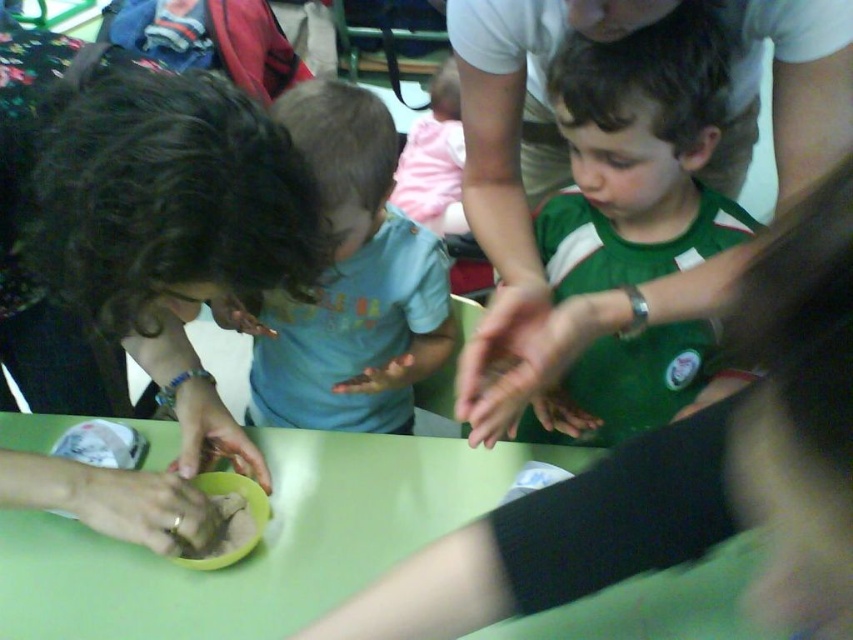
You are an observer watching the scene at the table. The smooth beige hand at lower left and the brown clay bowl at center are both on the table. Which object is bigger in size?

The smooth beige hand at lower left is larger in size compared to the brown clay bowl at center according to the description.

You are standing in front of the table and want to place a small object on the smooth beige hand at lower left. Where should you aim to place it?

You should aim for the coordinates point (142,508) to place the small object on the smooth beige hand at lower left.